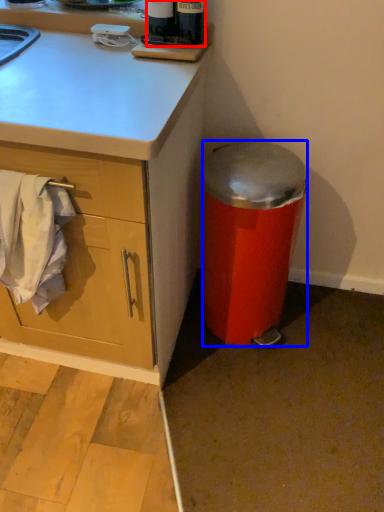
Question: Which of the following is the farthest to the observer, bottle (highlighted by a red box) or trash bin/can (highlighted by a blue box)?

Choices:
 (A) bottle
 (B) trash bin/can

Answer: (B)